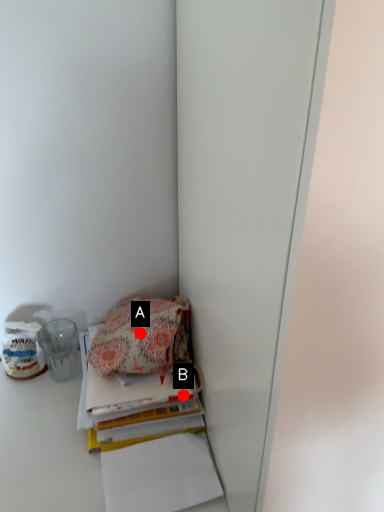
Question: Two points are circled on the image, labeled by A and B beside each circle. Which point is farther from the camera taking this photo?

Choices:
 (A) A is further
 (B) B is further

Answer: (A)